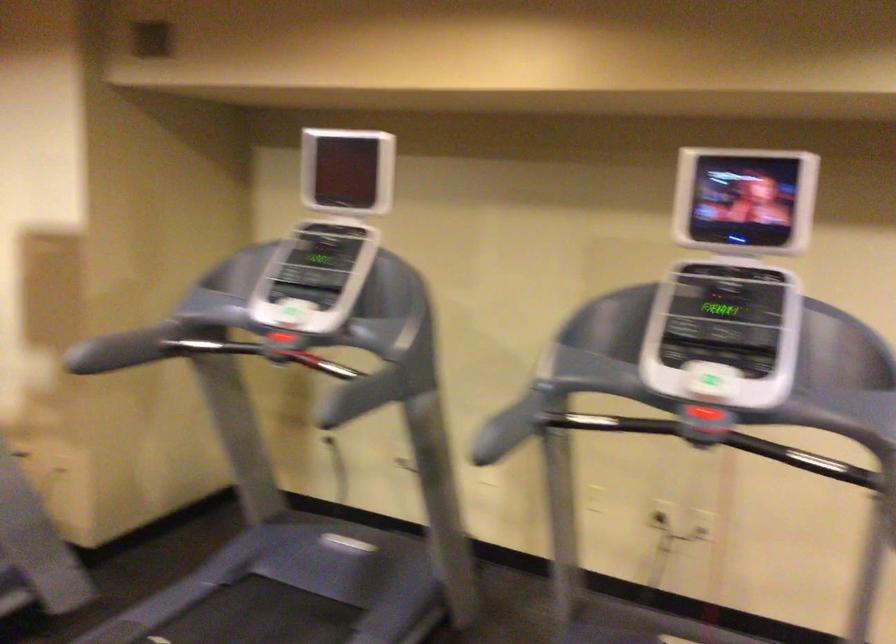
The first image is from the beginning of the video and the second image is from the end. How did the camera likely rotate when shooting the video?

The camera rotated toward left-down.